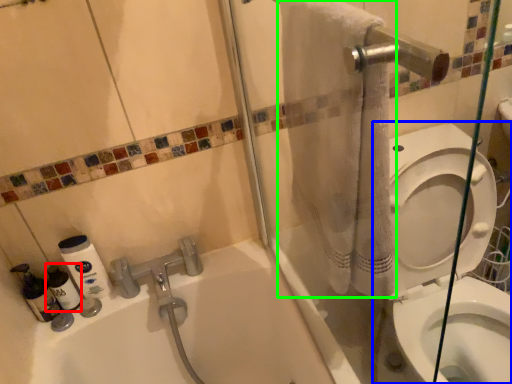
Question: Based on their relative distances, which object is nearer to cleaning product (highlighted by a red box)? Choose from toilet (highlighted by a blue box) and bath towel (highlighted by a green box).

Choices:
 (A) toilet
 (B) bath towel

Answer: (B)